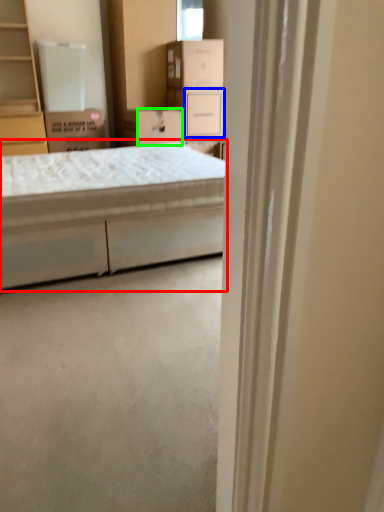
Question: Estimate the real-world distances between objects in this image. Which object is farther from bed (highlighted by a red box), storage box (highlighted by a blue box) or storage box (highlighted by a green box)?

Choices:
 (A) storage box
 (B) storage box

Answer: (A)